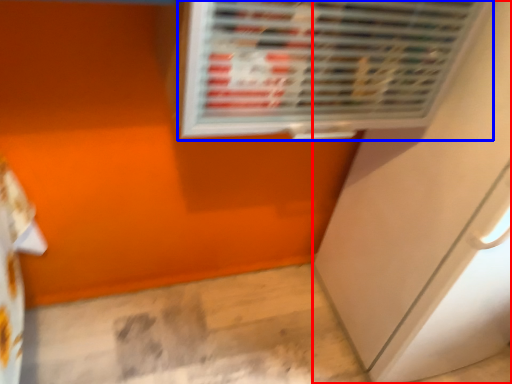
Question: Among these objects, which one is farthest to the camera, screen door (highlighted by a red box) or air conditioning (highlighted by a blue box)?

Choices:
 (A) screen door
 (B) air conditioning

Answer: (A)